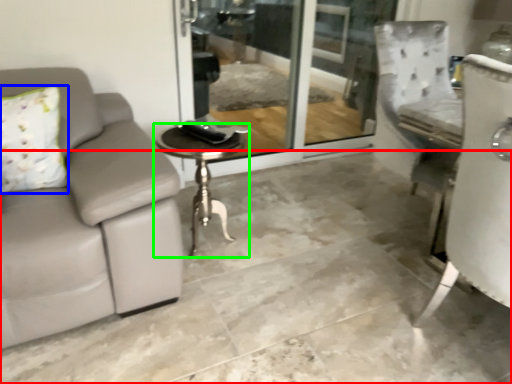
Question: Considering the real-world distances, which object is closest to concrete (highlighted by a red box)? pillow (highlighted by a blue box) or table (highlighted by a green box).

Choices:
 (A) pillow
 (B) table

Answer: (B)